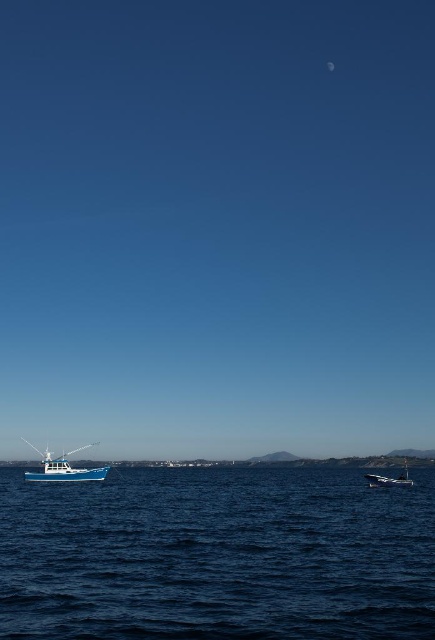
Question: Which object is closer to the camera taking this photo?

Choices:
 (A) blue water at lower left
 (B) shiny blue boat at lower right

Answer: (A)

Question: Does blue water at lower left have a greater width compared to shiny blue boat at lower right?

Choices:
 (A) yes
 (B) no

Answer: (A)

Question: Which is farther from the blue matte fishing boat at lower left?

Choices:
 (A) shiny blue boat at lower right
 (B) blue water at lower left

Answer: (A)

Question: Which point is closer to the camera taking this photo?

Choices:
 (A) (99, 477)
 (B) (87, 611)
 (C) (398, 477)

Answer: (B)

Question: Is blue matte fishing boat at lower left below shiny blue boat at lower right?

Choices:
 (A) yes
 (B) no

Answer: (A)

Question: Is blue matte fishing boat at lower left below shiny blue boat at lower right?

Choices:
 (A) yes
 (B) no

Answer: (A)